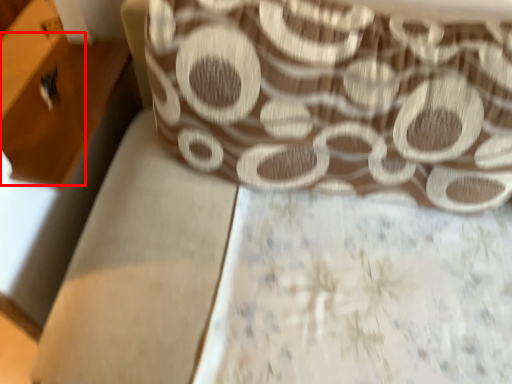
Question: Considering the relative positions of drawer (annotated by the red box) and curtain in the image provided, where is drawer (annotated by the red box) located with respect to the staircase?

Choices:
 (A) left
 (B) right

Answer: (A)